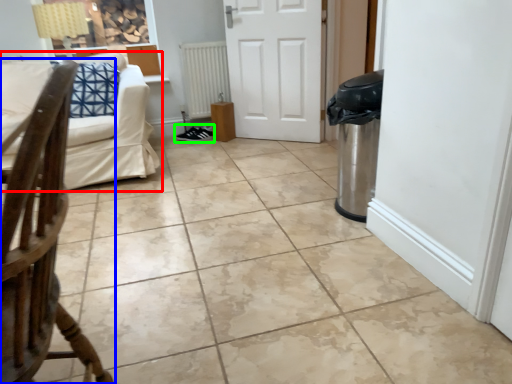
Question: Considering the real-world distances, which object is closest to studio couch (highlighted by a red box)? chair (highlighted by a blue box) or footwear (highlighted by a green box).

Choices:
 (A) chair
 (B) footwear

Answer: (B)